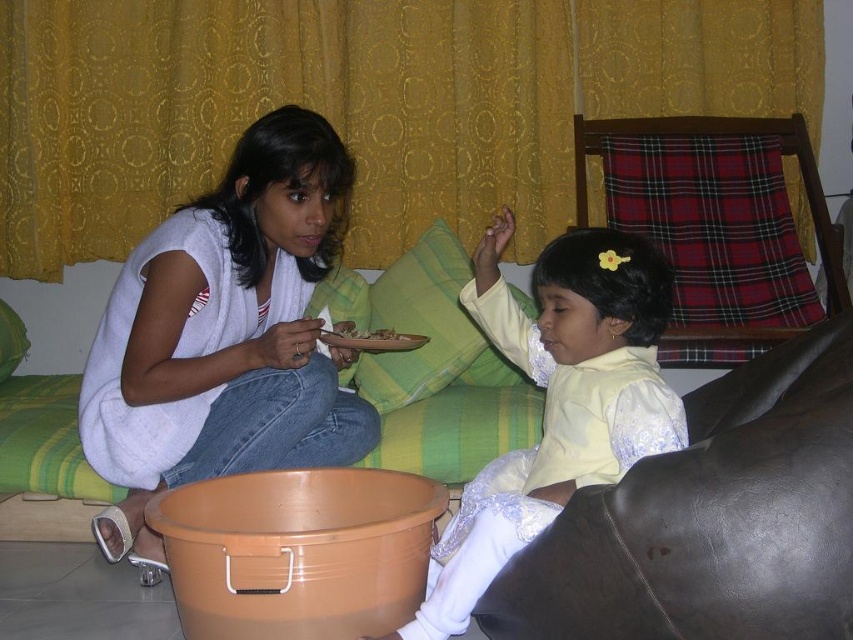
You are a photographer setting up a shoot in this living room. You need to ensure that the matte yellow dress at center and the smooth brown plate at center are both visible in the frame. Given their sizes, which object should you prioritize positioning closer to the camera to maintain clarity and detail?

The matte yellow dress at center is larger than the smooth brown plate at center, so you should prioritize positioning the smooth brown plate at center closer to the camera to maintain clarity and detail since smaller objects need to be closer to ensure they are visible and detailed in the photo.

You are a photographer setting up a shoot in this living room. You need to place a small prop between the silky yellow dress at center and the smooth brown plate at center. According to the scene description, where should you position the prop so it is directly in line with both objects?

The silky yellow dress at center is located below the smooth brown plate at center, so the prop should be placed between them along the vertical axis to be in line with both objects.

You are organizing a small party and need to place a decorative pillow on the sofa. The sofa has a green and yellow striped section and a brown leather section. According to the image, where should you place the decorative pillow to ensure it is near the matte white sweater at center?

The matte white sweater at center is located at point (225,333), so you should place the decorative pillow near the green and yellow striped sofa since the sweater is positioned there.